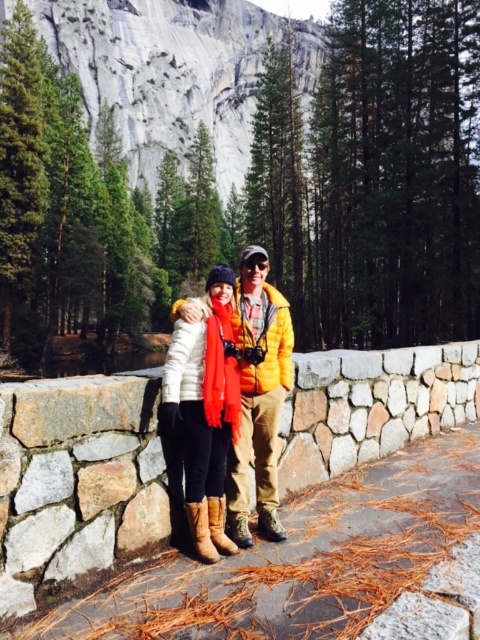
Question: Which object is farther from the camera taking this photo?

Choices:
 (A) matte white rock at upper center
 (B) brown leather boot at lower center

Answer: (A)

Question: Estimate the real-world distances between objects in this image. Which object is closer to the brown leather boot at lower center?

Choices:
 (A) matte white rock at upper center
 (B) matte orange scarf at center
 (C) brown suede boot at lower center

Answer: (C)

Question: Is matte white rock at upper center in front of matte orange scarf at center?

Choices:
 (A) yes
 (B) no

Answer: (B)

Question: Does matte orange scarf at center have a lesser width compared to brown leather boot at lower center?

Choices:
 (A) no
 (B) yes

Answer: (A)

Question: Does matte orange scarf at center appear on the left side of brown suede boot at lower center?

Choices:
 (A) no
 (B) yes

Answer: (A)

Question: Considering the real-world distances, which object is farthest from the brown suede boot at lower center?

Choices:
 (A) brown leather boot at lower center
 (B) matte orange scarf at center

Answer: (B)